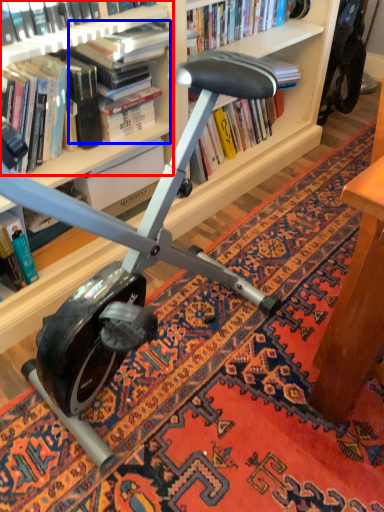
Question: Which object appears closest to the camera in this image, book (highlighted by a red box) or book (highlighted by a blue box)?

Choices:
 (A) book
 (B) book

Answer: (A)